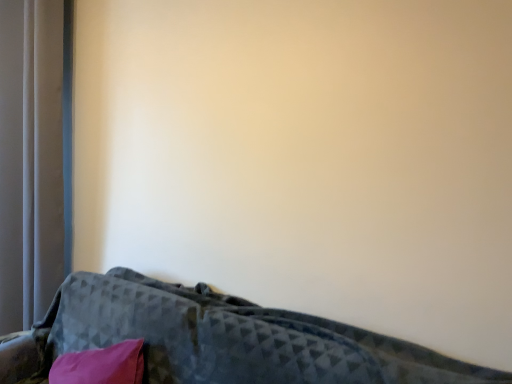
Question: Is velvet dark gray couch at lower left located within silky gray curtain at left?

Choices:
 (A) yes
 (B) no

Answer: (B)

Question: Can you confirm if silky gray curtain at left is shorter than velvet dark gray couch at lower left?

Choices:
 (A) yes
 (B) no

Answer: (B)

Question: Considering the relative sizes of silky gray curtain at left and velvet dark gray couch at lower left in the image provided, is silky gray curtain at left wider than velvet dark gray couch at lower left?

Choices:
 (A) no
 (B) yes

Answer: (A)

Question: Is silky gray curtain at left beside velvet dark gray couch at lower left?

Choices:
 (A) no
 (B) yes

Answer: (A)

Question: From a real-world perspective, is silky gray curtain at left below velvet dark gray couch at lower left?

Choices:
 (A) yes
 (B) no

Answer: (B)

Question: Considering the relative positions of silky gray curtain at left and velvet dark gray couch at lower left in the image provided, is silky gray curtain at left to the left of velvet dark gray couch at lower left from the viewer's perspective?

Choices:
 (A) no
 (B) yes

Answer: (B)

Question: Considering the relative positions of velvet dark gray couch at lower left and silky gray curtain at left in the image provided, is velvet dark gray couch at lower left to the left of silky gray curtain at left from the viewer's perspective?

Choices:
 (A) yes
 (B) no

Answer: (B)

Question: Does velvet dark gray couch at lower left have a lesser height compared to silky gray curtain at left?

Choices:
 (A) no
 (B) yes

Answer: (B)

Question: Could you tell me if velvet dark gray couch at lower left is turned towards silky gray curtain at left?

Choices:
 (A) no
 (B) yes

Answer: (A)

Question: Is velvet dark gray couch at lower left thinner than silky gray curtain at left?

Choices:
 (A) yes
 (B) no

Answer: (B)

Question: From the image's perspective, would you say velvet dark gray couch at lower left is shown under silky gray curtain at left?

Choices:
 (A) yes
 (B) no

Answer: (A)

Question: From the image's perspective, is velvet dark gray couch at lower left on silky gray curtain at left?

Choices:
 (A) no
 (B) yes

Answer: (A)

Question: From their relative heights in the image, would you say silky gray curtain at left is taller or shorter than velvet dark gray couch at lower left?

Choices:
 (A) tall
 (B) short

Answer: (A)